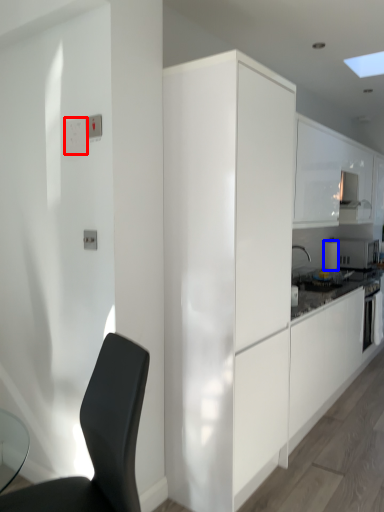
Question: Which point is closer to the camera, light switch (highlighted by a red box) or appliance (highlighted by a blue box)?

Choices:
 (A) light switch
 (B) appliance

Answer: (A)